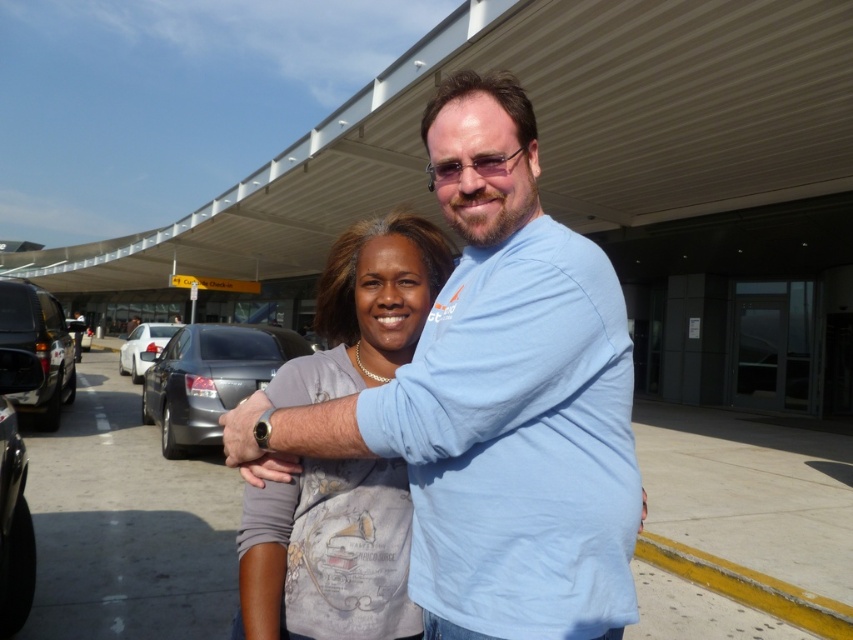
Can you confirm if matte gray shirt at center is positioned below matte black suv at left?

Indeed, matte gray shirt at center is positioned under matte black suv at left.

Based on the photo, between matte gray shirt at center and matte black suv at left, which one is positioned lower?

matte gray shirt at center is below.

Is point (276, 616) positioned behind point (16, 340)?

That is False.

Image resolution: width=853 pixels, height=640 pixels. Find the location of `matte gray shirt at center`. matte gray shirt at center is located at coordinates (328, 556).

Is gray metallic sedan at center positioned in front of shiny black car at left?

No.

Describe the element at coordinates (209, 378) in the screenshot. This screenshot has width=853, height=640. I see `gray metallic sedan at center` at that location.

Who is more distant from viewer, (206, 381) or (16, 536)?

Positioned behind is point (206, 381).

Locate an element on the screen. gray metallic sedan at center is located at coordinates (209, 378).

Can you confirm if matte black suv at left is taller than shiny black car at left?

No, matte black suv at left is not taller than shiny black car at left.

Between matte black suv at left and shiny black car at left, which one appears on the left side from the viewer's perspective?

matte black suv at left

The height and width of the screenshot is (640, 853). What do you see at coordinates (38, 348) in the screenshot?
I see `matte black suv at left` at bounding box center [38, 348].

Where is `matte black suv at left`? The image size is (853, 640). matte black suv at left is located at coordinates tap(38, 348).